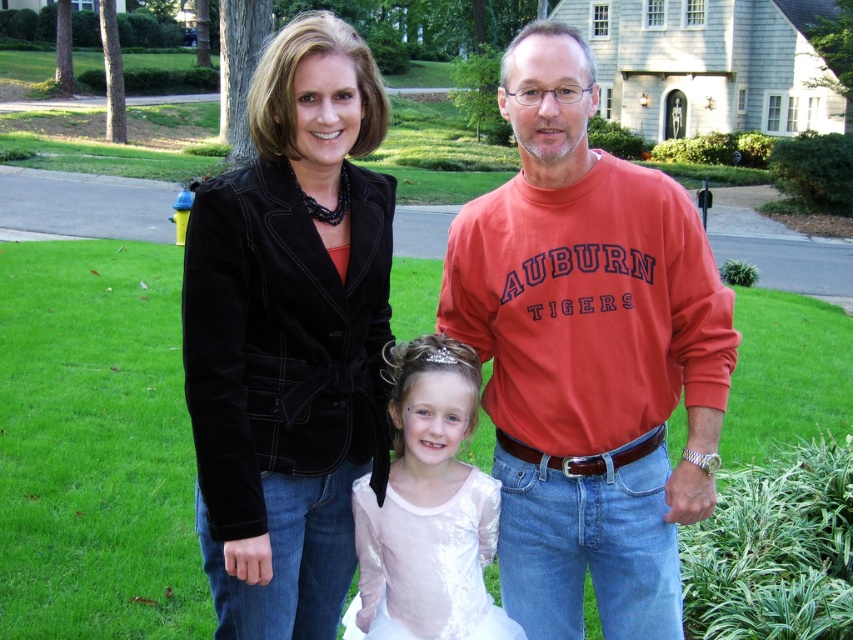
Is point (636, 602) positioned after point (448, 499)?

Yes.

Which is more to the left, orange cotton sweatshirt at center or white satin dress at center?

white satin dress at center

Is point (627, 296) farther from camera compared to point (413, 529)?

Yes, it is behind point (413, 529).

This screenshot has width=853, height=640. In order to click on orange cotton sweatshirt at center in this screenshot , I will do 587,355.

Does point (573, 493) lie in front of point (343, 282)?

That is False.

Consider the image. Who is lower down, orange cotton sweatshirt at center or black velvet jacket at center?

black velvet jacket at center

The height and width of the screenshot is (640, 853). In order to click on orange cotton sweatshirt at center in this screenshot , I will do `click(587, 355)`.

Which of these two, black velvet jacket at center or white satin dress at center, stands shorter?

black velvet jacket at center

Does point (294, 227) come closer to viewer compared to point (403, 483)?

Yes.

At what (x,y) coordinates should I click in order to perform the action: click on black velvet jacket at center. Please return your answer as a coordinate pair (x, y). The image size is (853, 640). Looking at the image, I should click on (289, 337).